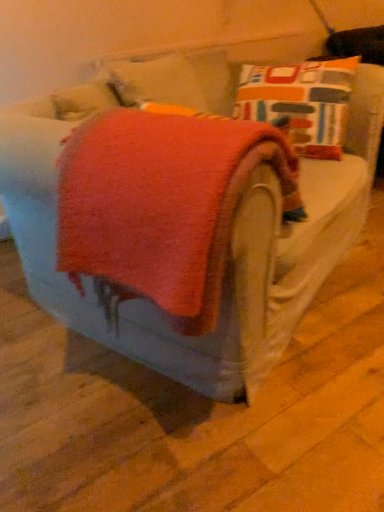
The image size is (384, 512). Describe the element at coordinates (163, 205) in the screenshot. I see `orange soft towel at center` at that location.

Consider the image. In order to face orange soft towel at center, should I rotate leftwards or rightwards?

To align with it, rotate left about 1.781°.

What is the approximate height of orange soft towel at center?

orange soft towel at center is 17.83 inches in height.

Where is `orange soft towel at center`? The height and width of the screenshot is (512, 384). orange soft towel at center is located at coordinates (163, 205).

What do you see at coordinates (228, 251) in the screenshot?
I see `orange fabric at center` at bounding box center [228, 251].

Locate an element on the screen. The height and width of the screenshot is (512, 384). orange fabric at center is located at coordinates (x=228, y=251).

Identify the location of orange soft towel at center. tap(163, 205).

Considering the positions of objects orange soft towel at center and orange fabric at center in the image provided, who is more to the right, orange soft towel at center or orange fabric at center?

From the viewer's perspective, orange fabric at center appears more on the right side.

In the image, is orange soft towel at center positioned in front of or behind orange fabric at center?

Visually, orange soft towel at center is located behind orange fabric at center.

Which is less distant, (x=123, y=191) or (x=358, y=198)?

The point (x=123, y=191) is closer to the camera.

From the image's perspective, which is below, orange soft towel at center or orange fabric at center?

orange fabric at center is shown below in the image.

From a real-world perspective, is orange soft towel at center above or below orange fabric at center?

orange soft towel at center is situated higher than orange fabric at center in the real world.

Is orange soft towel at center thinner than orange fabric at center?

Indeed, orange soft towel at center has a lesser width compared to orange fabric at center.

Considering the sizes of objects orange soft towel at center and orange fabric at center in the image provided, who is taller, orange soft towel at center or orange fabric at center?

With more height is orange soft towel at center.

Who is smaller, orange soft towel at center or orange fabric at center?

With smaller size is orange soft towel at center.

Is orange soft towel at center outside of orange fabric at center?

Absolutely, orange soft towel at center is external to orange fabric at center.

Is orange soft towel at center beside orange fabric at center?

No.

Is orange fabric at center at the back of orange soft towel at center?

orange soft towel at center is not turned away from orange fabric at center.

At what (x,y) coordinates should I click in order to perform the action: click on furniture below the orange soft towel at center (from the image's perspective). Please return your answer as a coordinate pair (x, y). This screenshot has width=384, height=512. Looking at the image, I should click on (228, 251).

Considering the relative positions of orange fabric at center and orange soft towel at center in the image provided, is orange fabric at center to the right of orange soft towel at center from the viewer's perspective?

Yes.

Is orange fabric at center in front of or behind orange soft towel at center in the image?

Clearly, orange fabric at center is in front of orange soft towel at center.

Does point (254, 191) come closer to viewer compared to point (259, 123)?

That is True.

From the image's perspective, which is above, orange fabric at center or orange soft towel at center?

orange soft towel at center is shown above in the image.

From a real-world perspective, which object rests below the other?

orange fabric at center.

Looking at their sizes, would you say orange fabric at center is wider or thinner than orange soft towel at center?

Clearly, orange fabric at center has more width compared to orange soft towel at center.

Considering the sizes of objects orange fabric at center and orange soft towel at center in the image provided, who is shorter, orange fabric at center or orange soft towel at center?

With less height is orange fabric at center.

Between orange fabric at center and orange soft towel at center, which one has smaller size?

Smaller between the two is orange soft towel at center.

Consider the image. Is orange fabric at center positioned beyond the bounds of orange soft towel at center?

Yes, orange fabric at center is located beyond the bounds of orange soft towel at center.

Is orange fabric at center with orange soft towel at center?

No, orange fabric at center is not in contact with orange soft towel at center.

Is orange fabric at center facing towards orange soft towel at center?

No, orange fabric at center is not oriented towards orange soft towel at center.

How many degrees apart are the facing directions of orange fabric at center and orange soft towel at center?

69.6 degrees separate the facing orientations of orange fabric at center and orange soft towel at center.

In the image, there is a orange soft towel at center. What are the coordinates of `furniture below it (from a real-world perspective)` in the screenshot? It's located at (228, 251).

The height and width of the screenshot is (512, 384). I want to click on bath towel on the left of the orange fabric at center, so [163, 205].

The image size is (384, 512). In order to click on bath towel above the orange fabric at center (from the image's perspective) in this screenshot , I will do `click(163, 205)`.